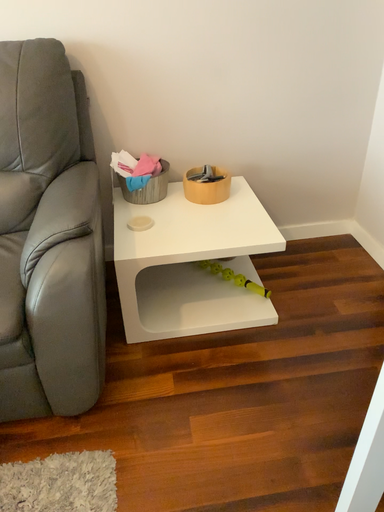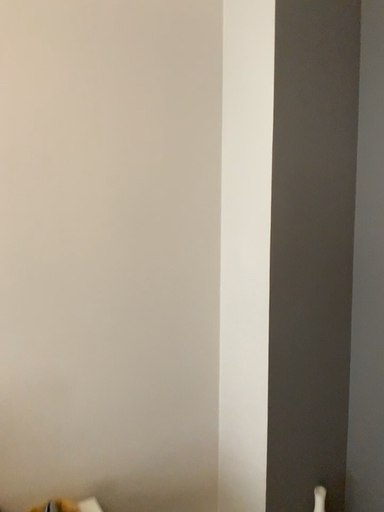
Question: How did the camera likely rotate when shooting the video?

Choices:
 (A) rotated right
 (B) rotated left

Answer: (A)